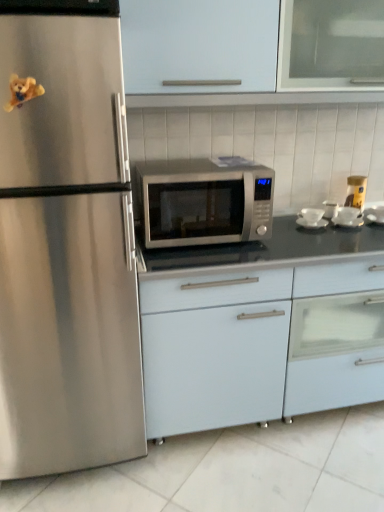
Question: From the image's perspective, is satin silver microwave at center, the second appliance in the right-to-left sequence, positioned above or below satin silver microwave at center?

Choices:
 (A) below
 (B) above

Answer: (A)

Question: Is point (337, 224) closer or farther from the camera than point (153, 173)?

Choices:
 (A) closer
 (B) farther

Answer: (B)

Question: Estimate the real-world distances between objects in this image. Which object is closer to the yellow matte jar at upper right, the first appliance in the right-to-left sequence?

Choices:
 (A) satin silver microwave at center, the second appliance in the right-to-left sequence
 (B) white matte cabinet at center, which is the 2th cabinetry from top to bottom
 (C) white glossy cabinet at upper center, acting as the 2th cabinetry starting from the bottom
 (D) satin silver microwave at center
 (E) white glossy bowl at right, placed as the 1th appliance when sorted from left to right

Answer: (A)

Question: Based on their relative distances, which object is nearer to the white glossy tile at lower center?

Choices:
 (A) white glossy cabinet at upper center, which ranks as the 1th cabinetry in top-to-bottom order
 (B) white matte cabinet at center, which is the 2th cabinetry from top to bottom
 (C) satin silver microwave at center
 (D) yellow matte jar at upper right, the first appliance in the right-to-left sequence
 (E) satin silver microwave at center, the second appliance in the right-to-left sequence

Answer: (B)